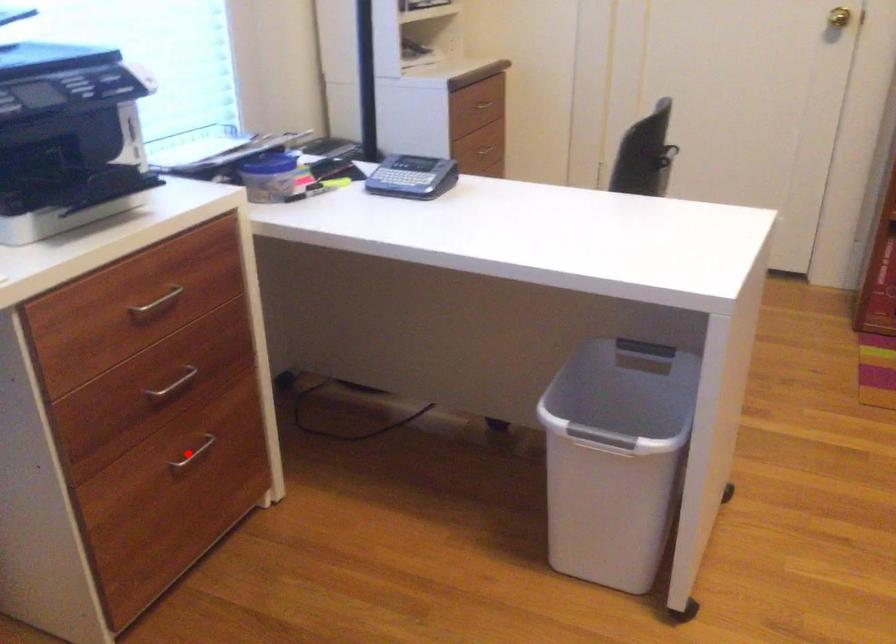
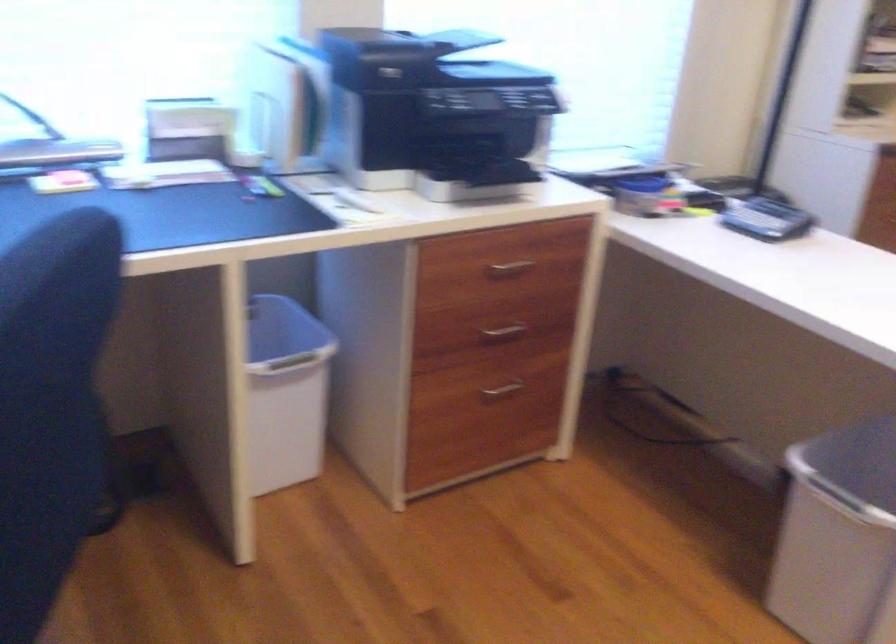
Question: I am providing you with two images of the same scene from different viewpoints. Given a red point in image1, look at the same physical point in image2. Is it:

Choices:
 (A) Closer to the viewpoint
 (B) Farther from the viewpoint

Answer: (B)